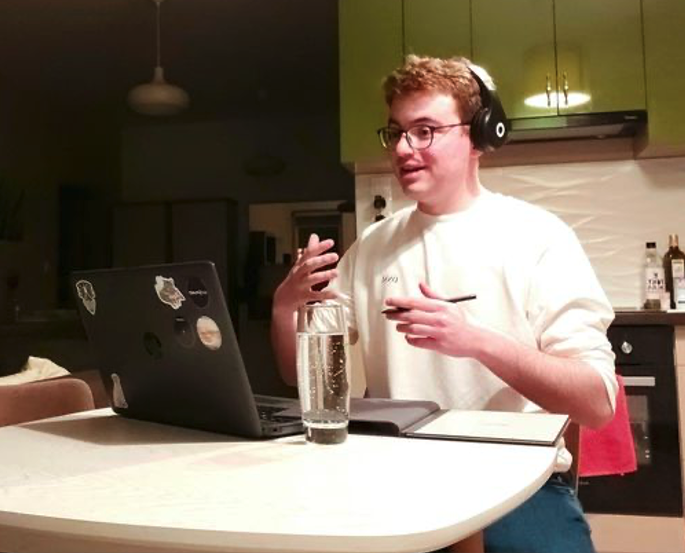
Locate an element on the screen. light is located at coordinates (257, 174).